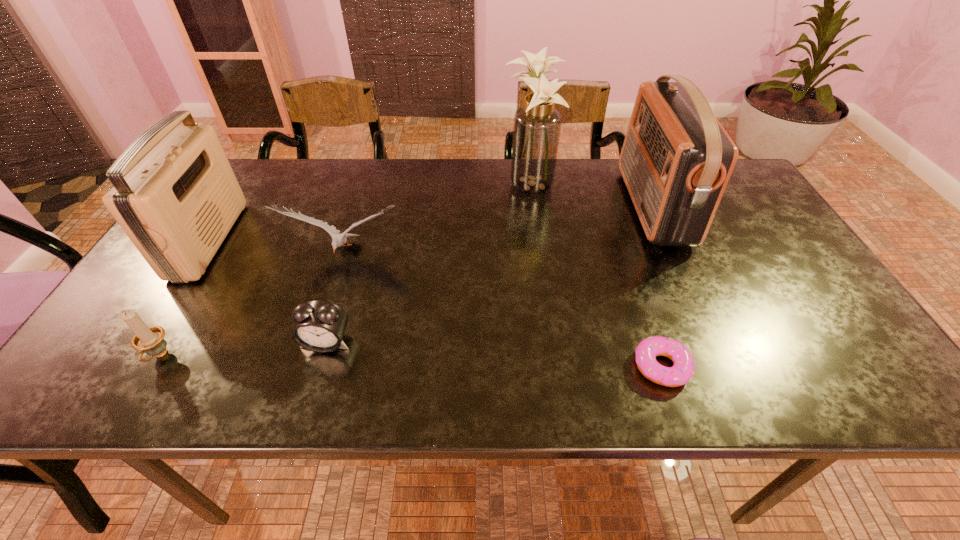
Identify the location of free space located on the front-facing side of the right radio receiver. Image resolution: width=960 pixels, height=540 pixels. (539, 206).

Identify the location of free space located on the front-facing side of the right radio receiver. (581, 206).

Where is `free space located on the front-facing side of the left radio receiver`? This screenshot has width=960, height=540. free space located on the front-facing side of the left radio receiver is located at coordinates (328, 240).

Locate an element on the screen. Image resolution: width=960 pixels, height=540 pixels. vacant space situated at the tip of the beak of the fourth tallest object is located at coordinates (331, 299).

The height and width of the screenshot is (540, 960). What are the coordinates of `vacant space situated 0.060m on the handle side of the candle_holder` in the screenshot? It's located at (133, 400).

The height and width of the screenshot is (540, 960). I want to click on free space located 0.100m on the right of the doughnut, so click(x=740, y=366).

Locate an element on the screen. flower arrangement that is at the far edge is located at coordinates (537, 125).

Locate an element on the screen. The height and width of the screenshot is (540, 960). candle_holder present at the near edge is located at coordinates (150, 340).

Image resolution: width=960 pixels, height=540 pixels. Identify the location of doughnut situated at the near edge. click(x=683, y=369).

Locate an element on the screen. This screenshot has width=960, height=540. radio receiver at the left edge is located at coordinates (175, 195).